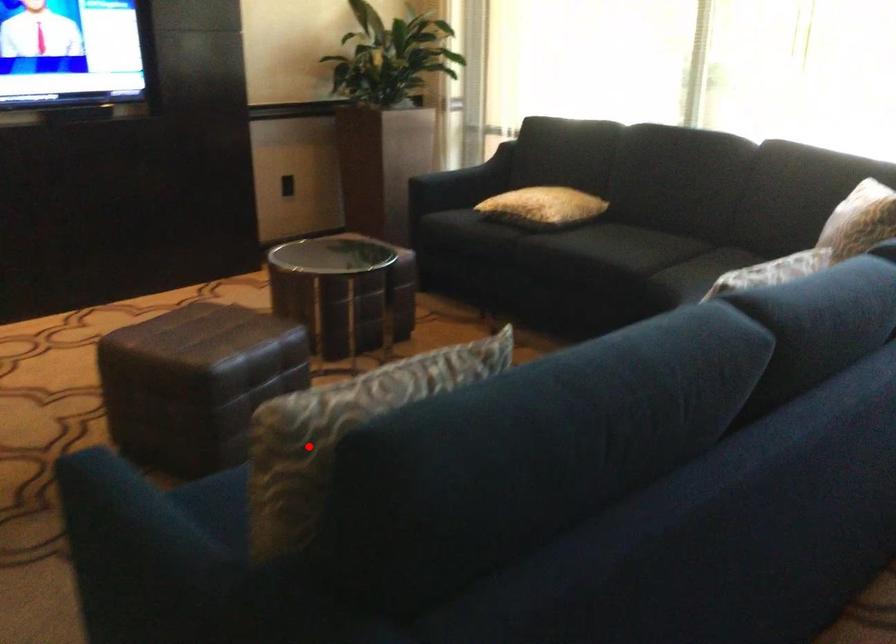
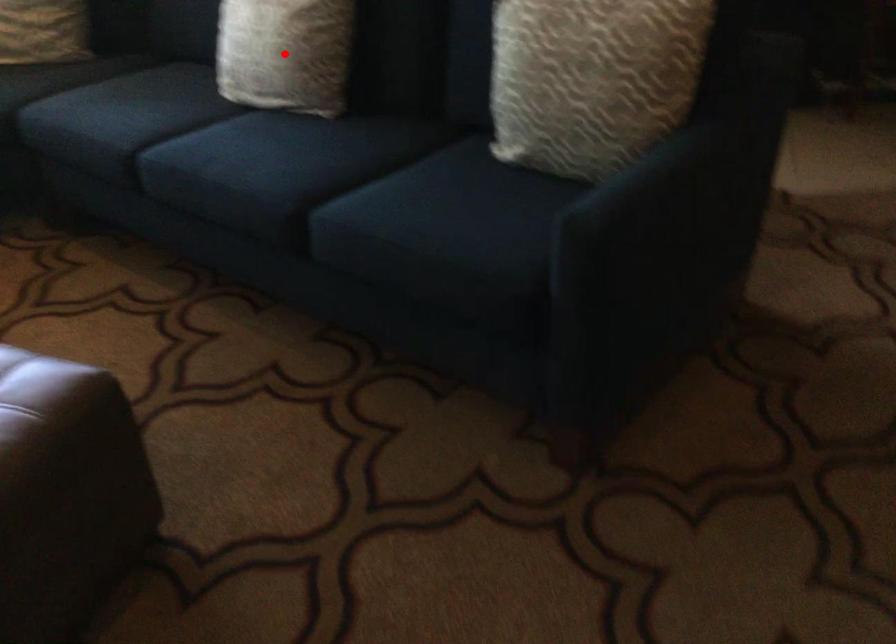
I am providing you with two images of the same scene from different viewpoints. A red point is marked on the first image and another point is marked on the second image. Is the marked point in image1 the same physical position as the marked point in image2?

No